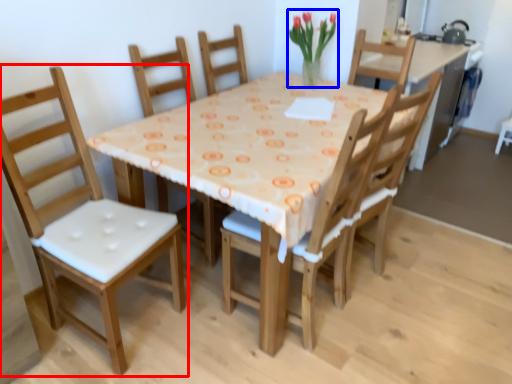
Question: Which of the following is the closest to the observer, chair (highlighted by a red box) or floral arrangement (highlighted by a blue box)?

Choices:
 (A) chair
 (B) floral arrangement

Answer: (A)